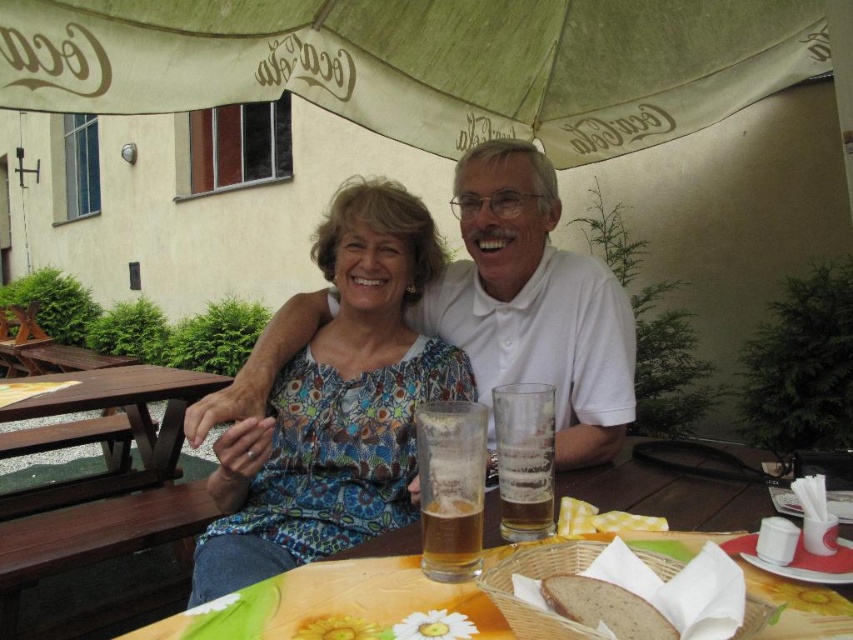
Consider the image. You are a waiter at this outdoor cafe. You need to place a dessert plate between the floral fabric blouse at center and the translucent glass at table center. Can you fit it there?

The floral fabric blouse at center is 23.68 inches away from the translucent glass at table center. The dessert plate requires at least 12 inches of space to be placed between them. Since the distance between them is more than 12 inches, the dessert plate can be placed between the floral fabric blouse at center and the translucent glass at table center.

You are a waiter at this outdoor cafe and need to place a new drink order on the table. The table has limited space. Where should you place the drink to avoid covering the brown matte bread at lower center and the yellow checkered napkin at lower center?

Place the drink in an area of the table that is not occupied by either the brown matte bread at lower center or the yellow checkered napkin at lower center. Since the brown matte bread is above the yellow checkered napkin, positioning the drink below the napkin or to the sides of both items would keep it from covering them.

You are a waiter at this outdoor cafe and need to place a 12 inch long spoon between the brown matte bread at lower center and the yellow checkered napkin at lower center. Can the spoon fit between them without overlapping either object?

The brown matte bread at lower center and yellow checkered napkin at lower center are 12.65 inches apart from each other. Since the spoon is 12 inches long, it can fit between them without overlapping either object as there is enough space.